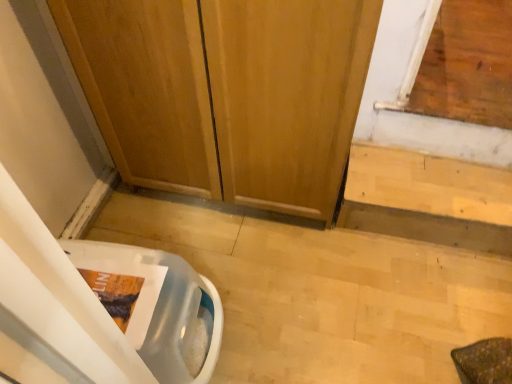
Question: Does translucent plastic toilet bowl at lower left have a lesser height compared to light wood stairs at lower right?

Choices:
 (A) yes
 (B) no

Answer: (B)

Question: Is translucent plastic toilet bowl at lower left oriented away from light wood stairs at lower right?

Choices:
 (A) no
 (B) yes

Answer: (A)

Question: Is translucent plastic toilet bowl at lower left outside light wood stairs at lower right?

Choices:
 (A) no
 (B) yes

Answer: (B)

Question: Does translucent plastic toilet bowl at lower left turn towards light wood stairs at lower right?

Choices:
 (A) yes
 (B) no

Answer: (B)

Question: Are translucent plastic toilet bowl at lower left and light wood stairs at lower right located far from each other?

Choices:
 (A) yes
 (B) no

Answer: (B)

Question: From a real-world perspective, relative to wooden door at center, is light wood stairs at lower right vertically above or below?

Choices:
 (A) above
 (B) below

Answer: (B)

Question: Choose the correct answer: Is light wood stairs at lower right inside wooden door at center or outside it?

Choices:
 (A) outside
 (B) inside

Answer: (A)

Question: In the image, is light wood stairs at lower right positioned in front of or behind wooden door at center?

Choices:
 (A) front
 (B) behind

Answer: (B)

Question: Would you say light wood stairs at lower right is to the left or to the right of wooden door at center in the picture?

Choices:
 (A) left
 (B) right

Answer: (B)

Question: Is translucent plastic toilet bowl at lower left bigger or smaller than wooden door at center?

Choices:
 (A) big
 (B) small

Answer: (B)

Question: Which is correct: translucent plastic toilet bowl at lower left is inside wooden door at center, or outside of it?

Choices:
 (A) outside
 (B) inside

Answer: (A)

Question: From a real-world perspective, is translucent plastic toilet bowl at lower left above or below wooden door at center?

Choices:
 (A) below
 (B) above

Answer: (A)

Question: Does point (176, 276) appear closer or farther from the camera than point (350, 6)?

Choices:
 (A) farther
 (B) closer

Answer: (A)

Question: Is point (434, 235) closer or farther from the camera than point (142, 291)?

Choices:
 (A) closer
 (B) farther

Answer: (B)

Question: Looking at their shapes, would you say light wood stairs at lower right is wider or thinner than translucent plastic toilet bowl at lower left?

Choices:
 (A) wide
 (B) thin

Answer: (B)